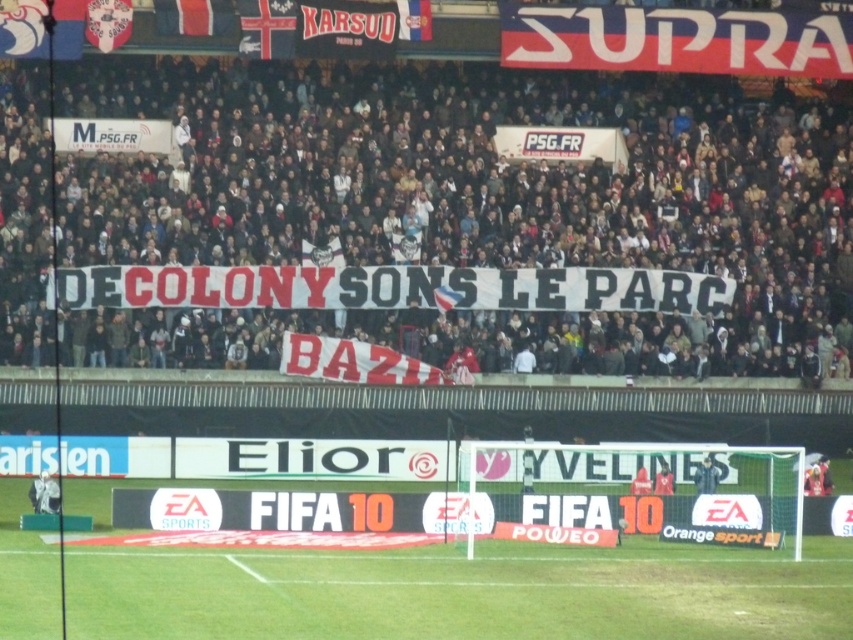
You are a photographer trying to capture the soccer field from the stands. You notice the green grass at lower center and the white fabric banner at center. Which object is closer to the camera?

The white fabric banner at center is closer to the camera because the green grass at lower center is behind it.

You are a photographer at the soccer stadium and want to capture a photo that includes both the white fabric banner at center and the green grass at lower center. Based on their positions, which object should you position closer to the left side of your camera frame?

The white fabric banner at center should be positioned closer to the left side of your camera frame since it is to the left of the green grass at lower center.

You are a photographer standing at the edge of the soccer field. You want to capture a photo that includes both the white fabric banner at center and the green grass at lower center. Which object will appear taller in your photo?

The white fabric banner at center will appear taller in the photo since it has a greater height compared to the green grass at lower center according to the description.